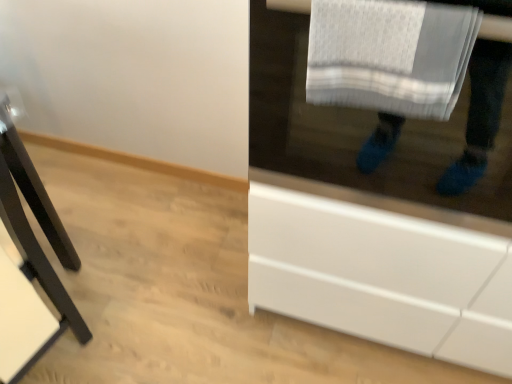
Where is `vacant space behind black matte table at left`? vacant space behind black matte table at left is located at coordinates (104, 249).